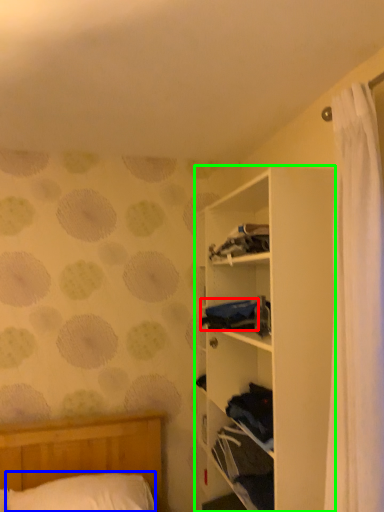
Question: Considering the real-world distances, which object is closest to clothing (highlighted by a red box)? pillow (highlighted by a blue box) or shelf (highlighted by a green box).

Choices:
 (A) pillow
 (B) shelf

Answer: (B)